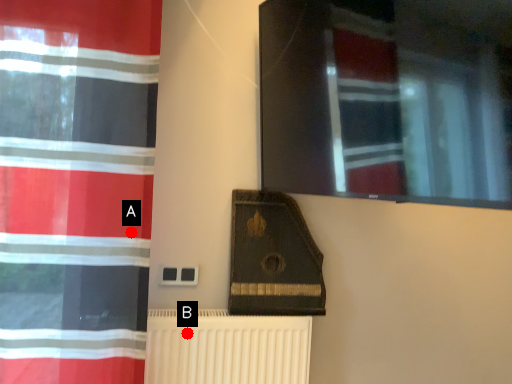
Question: Two points are circled on the image, labeled by A and B beside each circle. Which point is closer to the camera?

Choices:
 (A) A is closer
 (B) B is closer

Answer: (A)